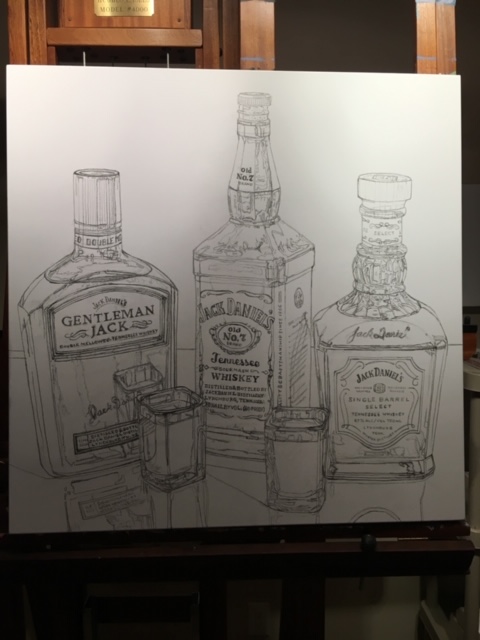
The height and width of the screenshot is (640, 480). What are the coordinates of `door frame` in the screenshot? It's located at (249, 32).